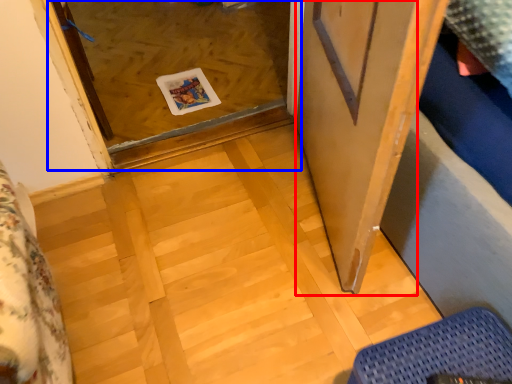
Question: Among these objects, which one is farthest to the camera, screen door (highlighted by a red box) or glass door (highlighted by a blue box)?

Choices:
 (A) screen door
 (B) glass door

Answer: (B)